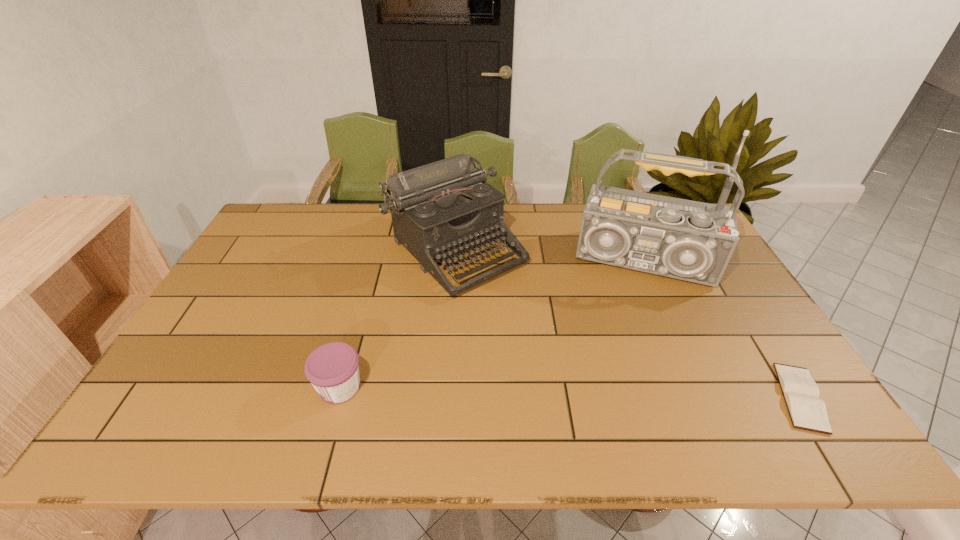
This screenshot has height=540, width=960. Find the location of `free space located on the typing side of the second tallest object`. free space located on the typing side of the second tallest object is located at coordinates (594, 381).

Identify the location of free location located 0.080m on the front-facing side of the radio receiver. The height and width of the screenshot is (540, 960). click(634, 315).

The height and width of the screenshot is (540, 960). I want to click on free space located 0.120m on the front-facing side of the radio receiver, so click(x=633, y=326).

The width and height of the screenshot is (960, 540). Find the location of `vacant space situated on the front-facing side of the radio receiver`. vacant space situated on the front-facing side of the radio receiver is located at coordinates (633, 323).

The width and height of the screenshot is (960, 540). Identify the location of typewriter that is at the far edge. (440, 209).

Where is `radio receiver that is at the far edge`? The width and height of the screenshot is (960, 540). radio receiver that is at the far edge is located at coordinates (694, 241).

At what (x,y) coordinates should I click in order to perform the action: click on jam located in the near edge section of the desktop. Please return your answer as a coordinate pair (x, y). The width and height of the screenshot is (960, 540). Looking at the image, I should click on (333, 369).

This screenshot has height=540, width=960. I want to click on diary that is at the near edge, so click(801, 393).

You are a GUI agent. You are given a task and a screenshot of the screen. Output one action in this format:
    pyautogui.click(x=<x>, y=<y>)
    Task: Click on the diary that is at the right edge
    
    Given the screenshot: What is the action you would take?
    pyautogui.click(x=801, y=393)

Find the location of `radio receiver present at the right edge`. radio receiver present at the right edge is located at coordinates (694, 241).